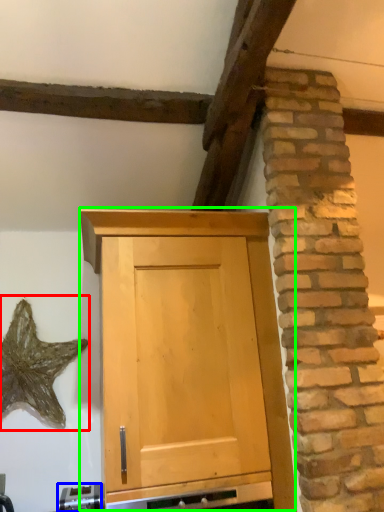
Question: Which object is the farthest from star (highlighted by a red box)? Choose among these: appliance (highlighted by a blue box) or cupboard (highlighted by a green box).

Choices:
 (A) appliance
 (B) cupboard

Answer: (B)